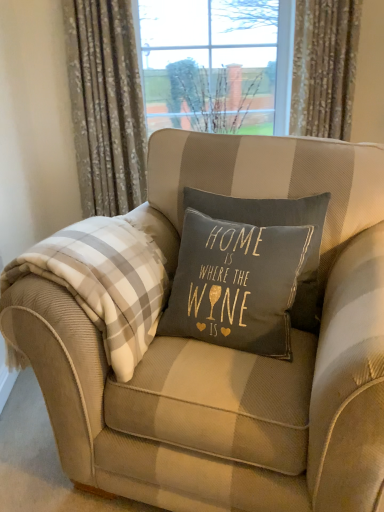
Question: Can you confirm if beige striped armchair at center is wider than floral fabric curtain at upper left, marked as the 2th curtain in a right-to-left arrangement?

Choices:
 (A) no
 (B) yes

Answer: (B)

Question: Is beige striped armchair at center oriented away from floral fabric curtain at upper left, the 1th curtain positioned from the left?

Choices:
 (A) no
 (B) yes

Answer: (A)

Question: From a real-world perspective, is beige striped armchair at center positioned over floral fabric curtain at upper left, marked as the 2th curtain in a right-to-left arrangement, based on gravity?

Choices:
 (A) no
 (B) yes

Answer: (A)

Question: From the image's perspective, is beige striped armchair at center beneath floral fabric curtain at upper left, the 1th curtain positioned from the left?

Choices:
 (A) yes
 (B) no

Answer: (A)

Question: Is beige striped armchair at center located outside floral fabric curtain at upper left, marked as the 2th curtain in a right-to-left arrangement?

Choices:
 (A) no
 (B) yes

Answer: (B)

Question: From a real-world perspective, is beige striped armchair at center physically located above or below white plaid blanket at left?

Choices:
 (A) below
 (B) above

Answer: (A)

Question: Is beige striped armchair at center to the left or to the right of white plaid blanket at left in the image?

Choices:
 (A) left
 (B) right

Answer: (B)

Question: In terms of height, does beige striped armchair at center look taller or shorter compared to white plaid blanket at left?

Choices:
 (A) tall
 (B) short

Answer: (A)

Question: Considering the positions of point (97, 466) and point (127, 351), is point (97, 466) closer or farther from the camera than point (127, 351)?

Choices:
 (A) farther
 (B) closer

Answer: (A)

Question: From the image's perspective, is floral fabric curtain at upper left, marked as the 2th curtain in a right-to-left arrangement, located above or below floral fabric curtain at upper right, which is the 2th curtain from left to right?

Choices:
 (A) below
 (B) above

Answer: (A)

Question: Choose the correct answer: Is floral fabric curtain at upper left, marked as the 2th curtain in a right-to-left arrangement, inside floral fabric curtain at upper right, which ranks as the first curtain in right-to-left order, or outside it?

Choices:
 (A) inside
 (B) outside

Answer: (B)

Question: From a real-world perspective, is floral fabric curtain at upper left, the 1th curtain positioned from the left, physically located above or below floral fabric curtain at upper right, which ranks as the first curtain in right-to-left order?

Choices:
 (A) below
 (B) above

Answer: (A)

Question: In terms of width, does floral fabric curtain at upper left, the 1th curtain positioned from the left, look wider or thinner when compared to floral fabric curtain at upper right, which ranks as the first curtain in right-to-left order?

Choices:
 (A) wide
 (B) thin

Answer: (A)

Question: In terms of height, does white plaid blanket at left look taller or shorter compared to floral fabric curtain at upper left, marked as the 2th curtain in a right-to-left arrangement?

Choices:
 (A) tall
 (B) short

Answer: (B)

Question: Which is correct: white plaid blanket at left is inside floral fabric curtain at upper left, marked as the 2th curtain in a right-to-left arrangement, or outside of it?

Choices:
 (A) inside
 (B) outside

Answer: (B)